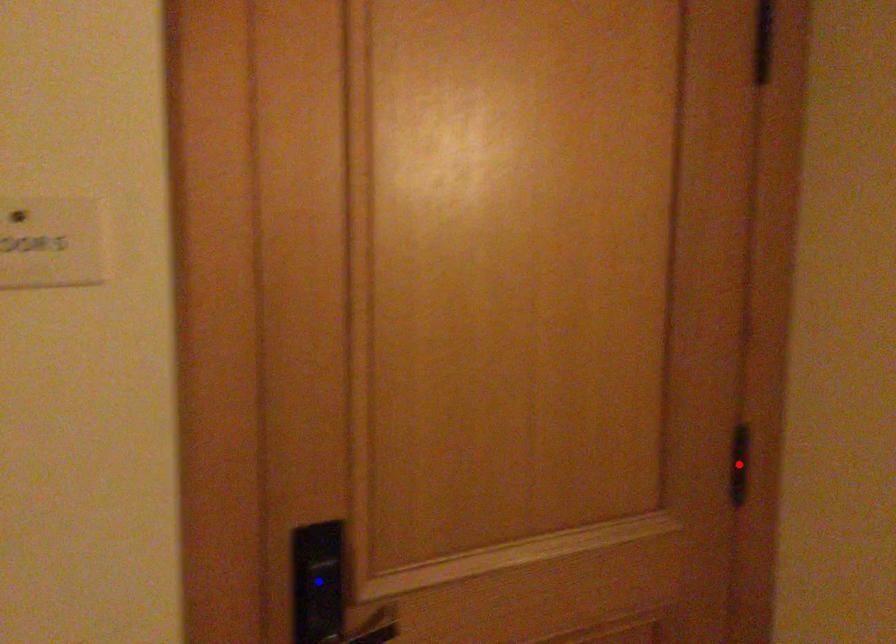
Question: In the image, two points are highlighted. Which point is nearer to the camera? Reply with the corresponding letter.

Choices:
 (A) blue point
 (B) red point

Answer: (A)